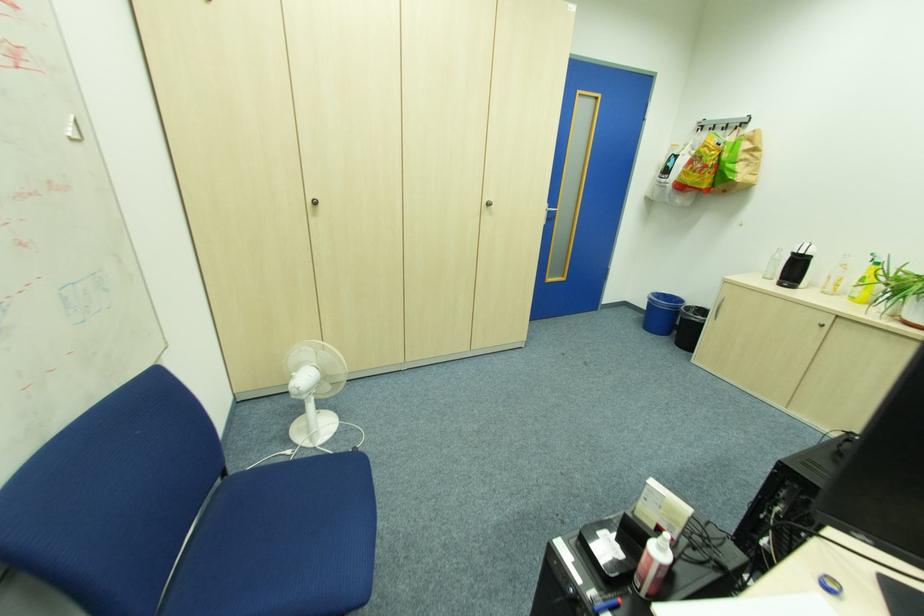
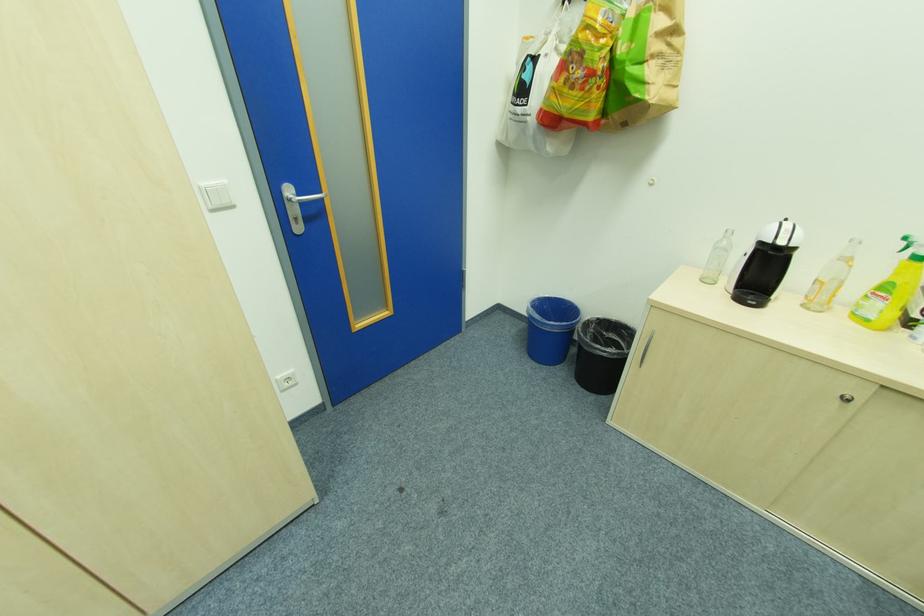
In the second image, find the point that corresponds to [850,257] in the first image.

(855, 243)